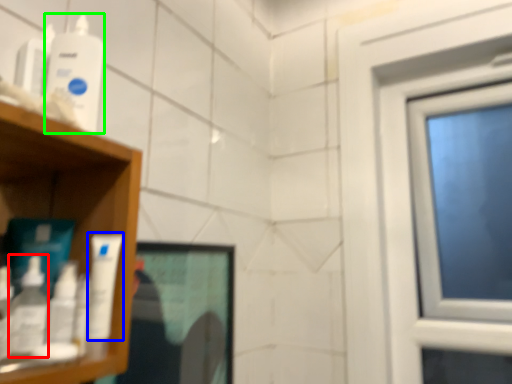
Question: Which object is positioned farthest from mouthwash (highlighted by a red box)? Select from mouthwash (highlighted by a blue box) and mouthwash (highlighted by a green box).

Choices:
 (A) mouthwash
 (B) mouthwash

Answer: (B)